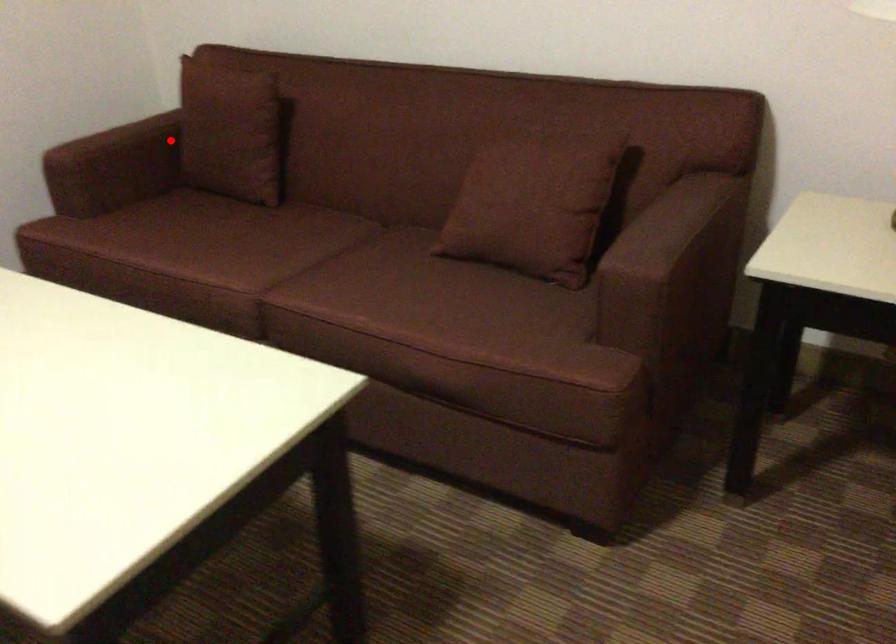
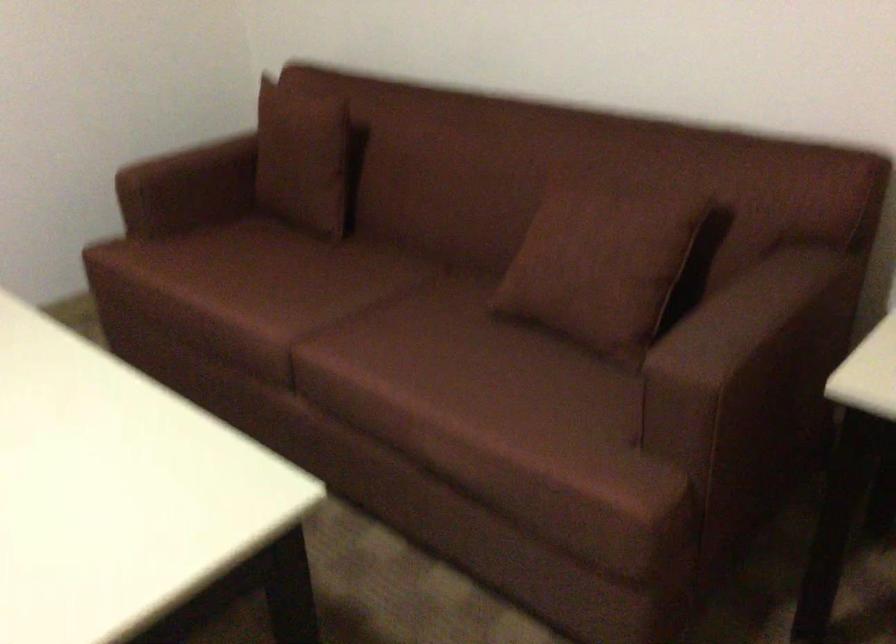
Where in the second image is the point corresponding to the highlighted location from the first image?

(246, 165)